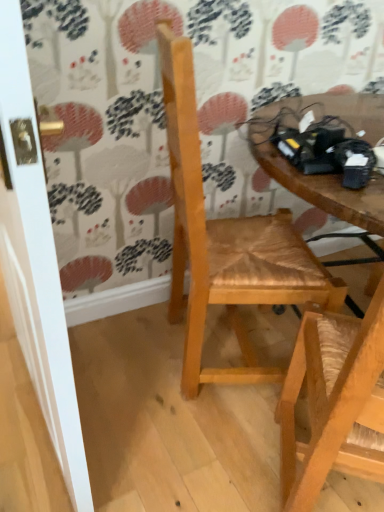
Question: Should I look upward or downward to see natural wood chair at center?

Choices:
 (A) down
 (B) up

Answer: (B)